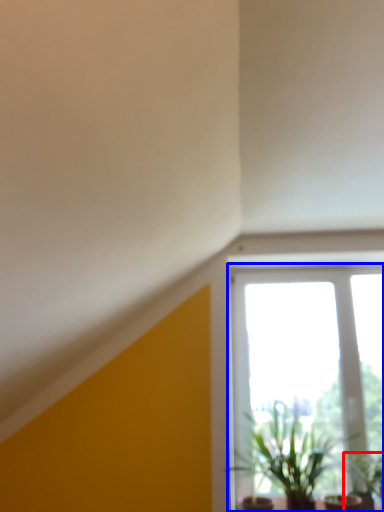
Question: Among these objects, which one is nearest to the camera, houseplant (highlighted by a red box) or window (highlighted by a blue box)?

Choices:
 (A) houseplant
 (B) window

Answer: (A)